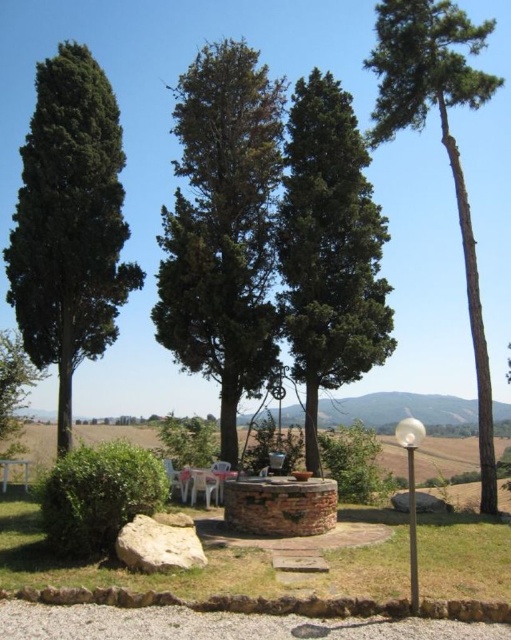
Does green rough bark tree at right have a smaller size compared to white plastic picnic table at lower left?

Incorrect, green rough bark tree at right is not smaller in size than white plastic picnic table at lower left.

The width and height of the screenshot is (511, 640). Identify the location of green rough bark tree at right. (442, 141).

I want to click on green rough bark tree at right, so click(442, 141).

Looking at this image, does green needle-like tree at left lie behind white plastic chair at center?

Yes, green needle-like tree at left is behind white plastic chair at center.

Is green needle-like tree at left closer to the viewer compared to white plastic chair at center?

No, green needle-like tree at left is further to the viewer.

Identify the location of green needle-like tree at left. (69, 224).

Where is `green needle-like tree at left`? The width and height of the screenshot is (511, 640). green needle-like tree at left is located at coordinates point(69,224).

Which of these two, white plastic picnic table at center or white plastic picnic table at lower left, stands taller?

With more height is white plastic picnic table at center.

Can you confirm if white plastic picnic table at center is positioned to the left of white plastic picnic table at lower left?

In fact, white plastic picnic table at center is to the right of white plastic picnic table at lower left.

You are a GUI agent. You are given a task and a screenshot of the screen. Output one action in this format:
    pyautogui.click(x=<x>, y=<y>)
    Task: Click on the white plastic picnic table at center
    Image resolution: width=511 pixels, height=640 pixels.
    Given the screenshot: What is the action you would take?
    pyautogui.click(x=208, y=483)